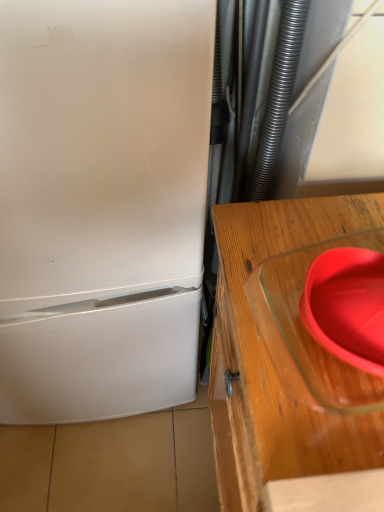
Locate an element on the screen. This screenshot has width=384, height=512. vacant space behind matte glass bowl at right is located at coordinates tap(304, 228).